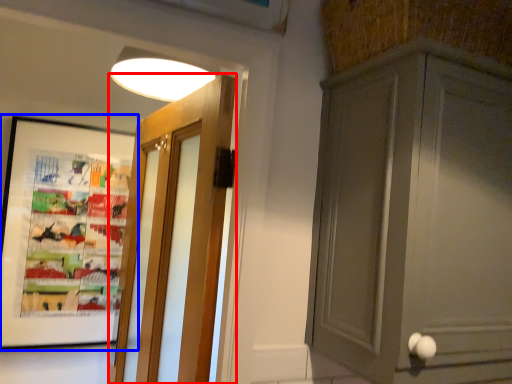
Question: Which object is closer to the camera taking this photo, door (highlighted by a red box) or picture frame (highlighted by a blue box)?

Choices:
 (A) door
 (B) picture frame

Answer: (A)